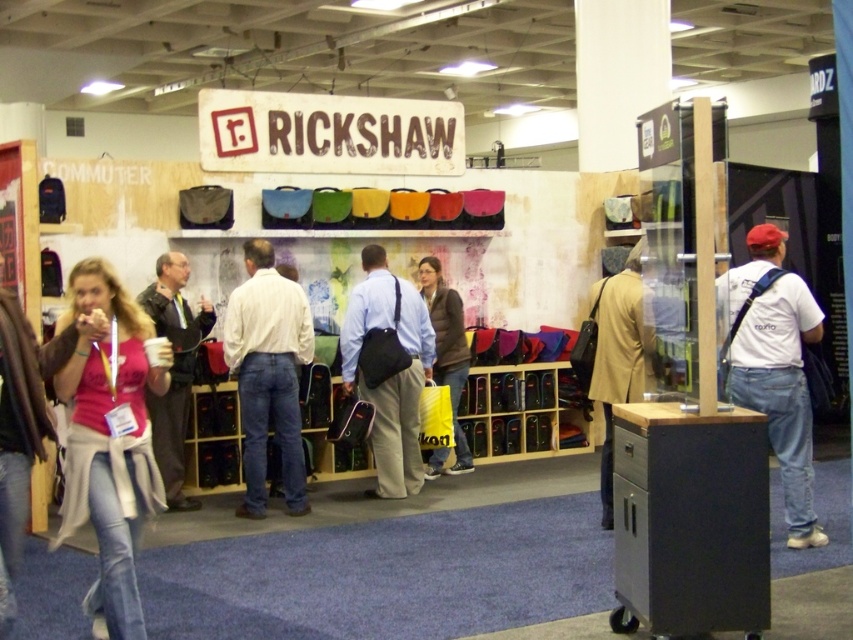
You are a customer at the Rickshaw booth and want to pick up the matte pink shirt at lower left and the matte black jacket at left. Which item is located higher on the display?

The matte black jacket at left is located higher than the matte pink shirt at lower left.

You are at a trade show booth for Rickshaw bags. You see a matte pink shirt at lower left. Where exactly is the matte pink shirt located in the booth?

The matte pink shirt at lower left is located at point (109, 442) in the booth.